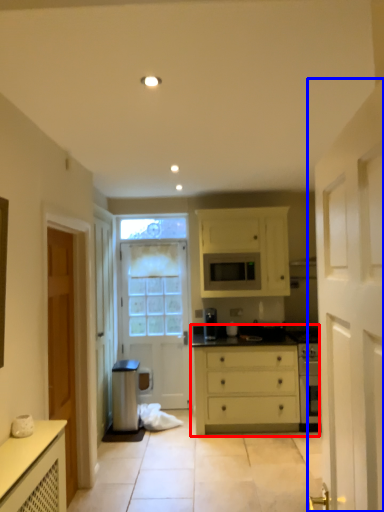
Question: Which point is further to the camera, chest of drawers (highlighted by a red box) or door (highlighted by a blue box)?

Choices:
 (A) chest of drawers
 (B) door

Answer: (A)